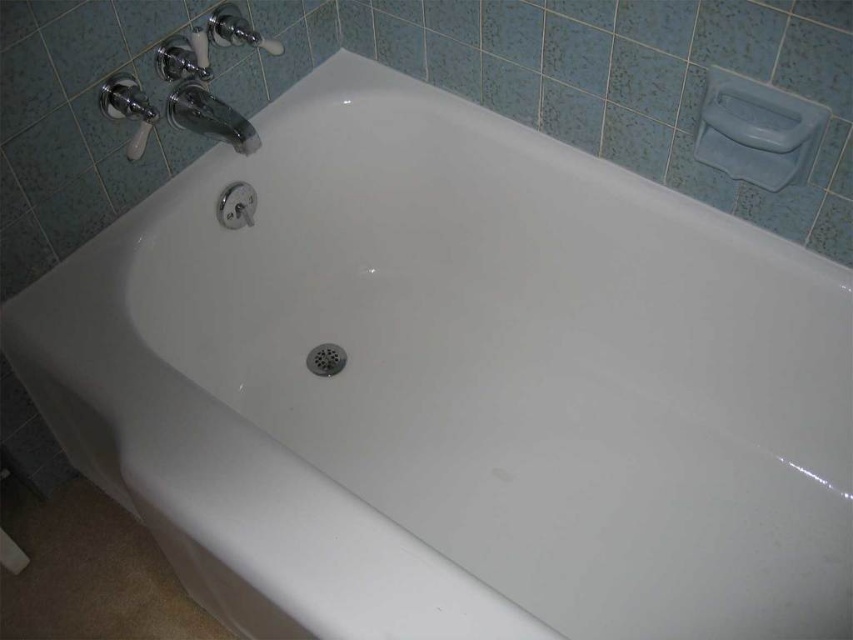
Question: Is chrome metallic faucet at upper left bigger than metallic silver drain at center?

Choices:
 (A) no
 (B) yes

Answer: (B)

Question: Is chrome metallic faucet at upper left thinner than metallic silver drain at center?

Choices:
 (A) yes
 (B) no

Answer: (B)

Question: Among these objects, which one is farthest from the camera?

Choices:
 (A) chrome metallic faucet at upper left
 (B) metallic silver drain at center

Answer: (B)

Question: Among these points, which one is farthest from the camera?

Choices:
 (A) (340, 356)
 (B) (175, 109)

Answer: (A)

Question: Does chrome metallic faucet at upper left have a greater width compared to metallic silver drain at center?

Choices:
 (A) yes
 (B) no

Answer: (A)